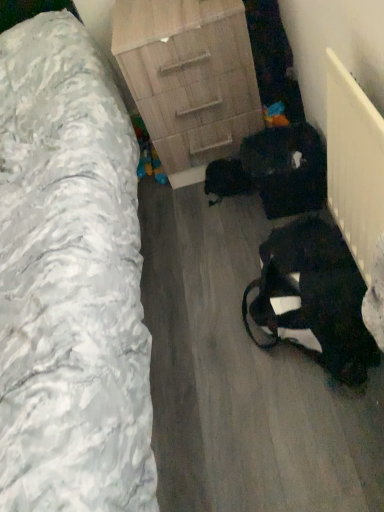
Where is `free space in front of black fabric bag at lower right`? This screenshot has height=512, width=384. free space in front of black fabric bag at lower right is located at coordinates (313, 450).